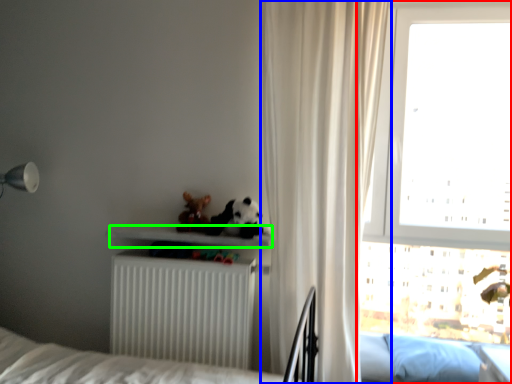
Question: Which is nearer to the window (highlighted by a red box)? curtain (highlighted by a blue box) or shelf (highlighted by a green box).

Choices:
 (A) curtain
 (B) shelf

Answer: (A)